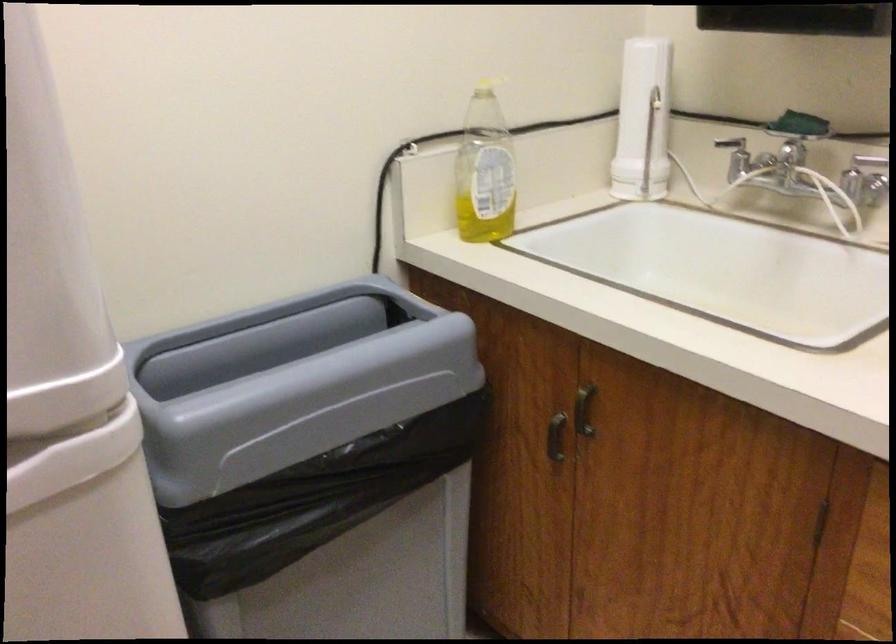
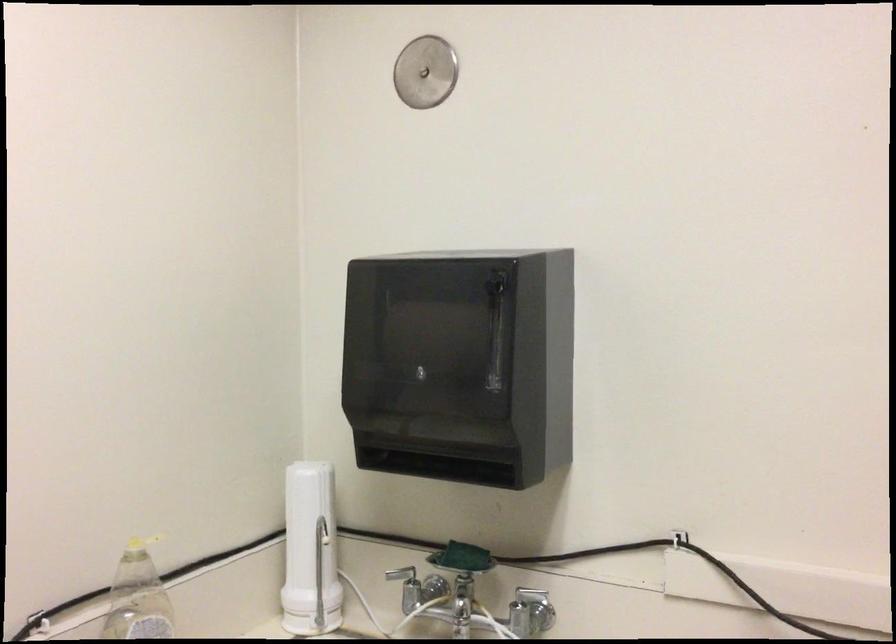
In the second image, find the point that corresponds to the point at 798,124 in the first image.

(462, 558)